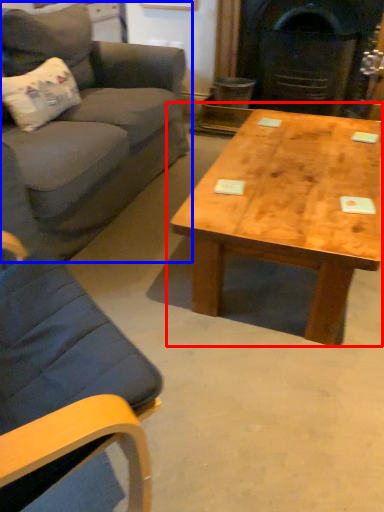
Question: Which object is closer to the camera taking this photo, coffee table (highlighted by a red box) or studio couch (highlighted by a blue box)?

Choices:
 (A) coffee table
 (B) studio couch

Answer: (B)